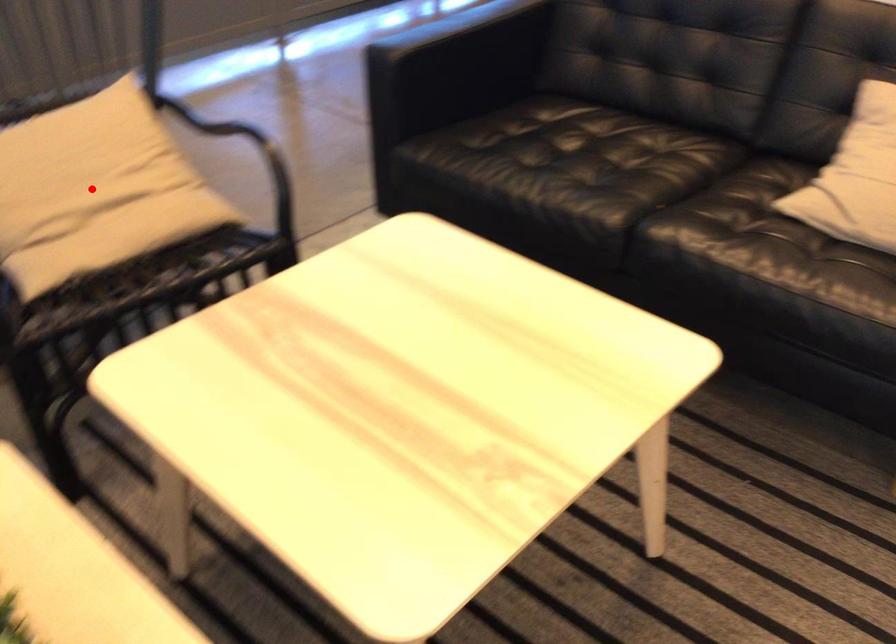
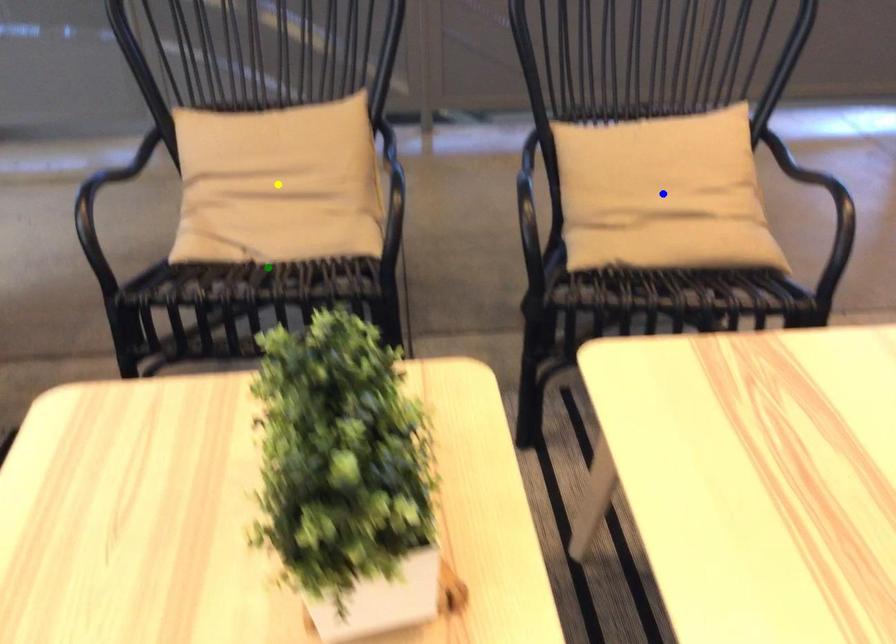
Question: I am providing you with two images of the same scene from different viewpoints. A red point is marked on the first image. You are given multiple points on the second image. Which mark in image 2 goes with the point in image 1?

Choices:
 (A) blue point
 (B) yellow point
 (C) green point

Answer: (A)